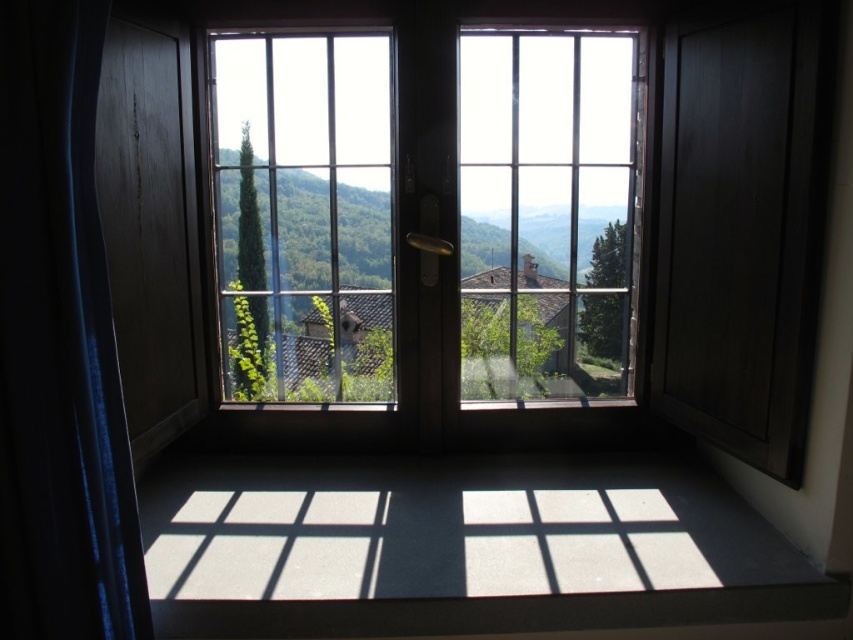
Question: Can you confirm if clear glass window at center is positioned to the right of blue fabric curtain at left?

Choices:
 (A) yes
 (B) no

Answer: (A)

Question: Is clear glass window at center bigger than blue fabric curtain at left?

Choices:
 (A) yes
 (B) no

Answer: (A)

Question: Which point is farther to the camera?

Choices:
 (A) (627, 68)
 (B) (33, 269)

Answer: (A)

Question: Can you confirm if clear glass window at center is positioned below blue fabric curtain at left?

Choices:
 (A) no
 (B) yes

Answer: (A)

Question: Which of the following is the closest to the observer?

Choices:
 (A) clear glass window at center
 (B) blue fabric curtain at left

Answer: (B)